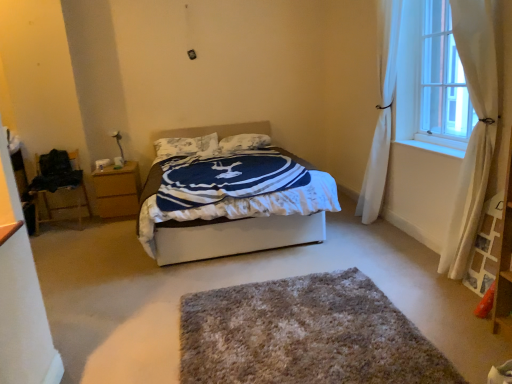
Where is `vacant space in front of wooden nightstand at left`? Image resolution: width=512 pixels, height=384 pixels. vacant space in front of wooden nightstand at left is located at coordinates (109, 230).